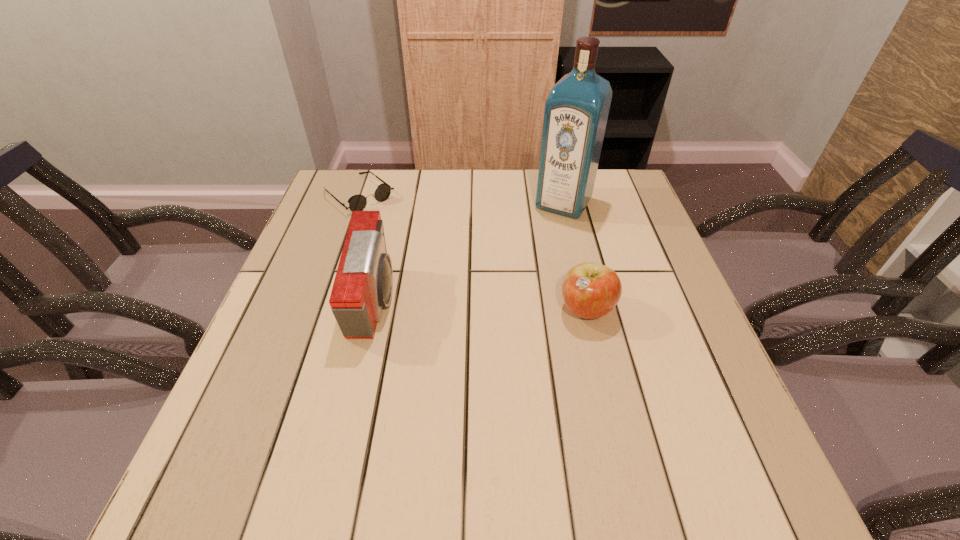
You are a GUI agent. You are given a task and a screenshot of the screen. Output one action in this format:
    pyautogui.click(x=<x>, y=<y>)
    Task: Click on the vacant space on the desktop that is between the camera and the apple and is positioned on the flat label side of the tallest object
    Image resolution: width=960 pixels, height=540 pixels.
    Given the screenshot: What is the action you would take?
    pyautogui.click(x=498, y=307)

Where is `free space on the desktop that is between the third shortest object and the apple and is positioned on the front-facing side of the sunglasses`? The height and width of the screenshot is (540, 960). free space on the desktop that is between the third shortest object and the apple and is positioned on the front-facing side of the sunglasses is located at coordinates (496, 306).